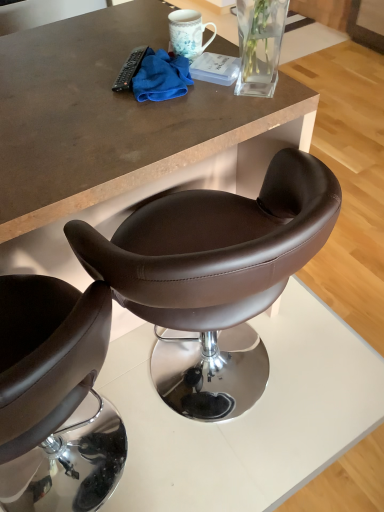
This screenshot has width=384, height=512. Identify the location of vacant space in front of blue microfiber cloth at upper center. (167, 125).